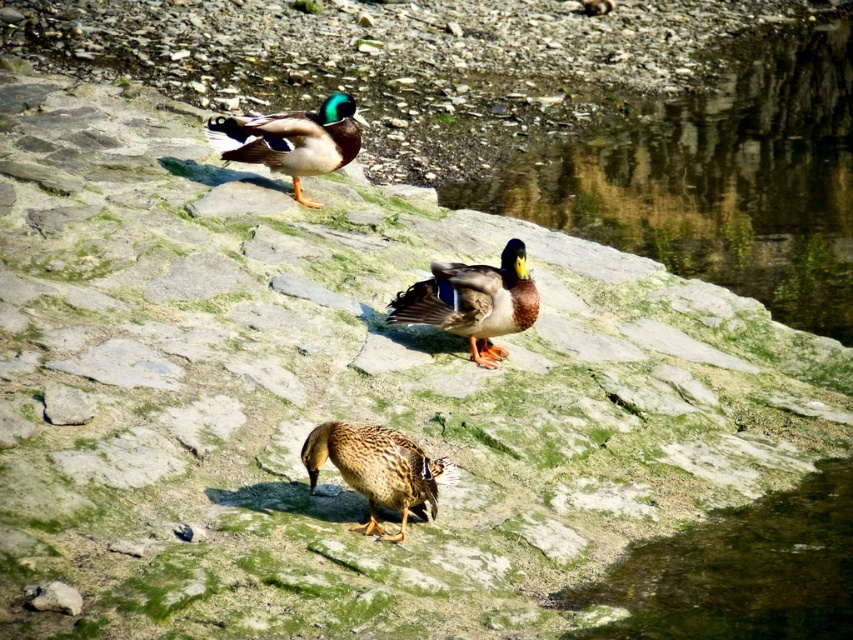
Does shiny brown duck at center have a greater width compared to shiny green and brown duck at upper center?

Incorrect, shiny brown duck at center's width does not surpass shiny green and brown duck at upper center's.

Does shiny brown duck at center come in front of shiny green and brown duck at upper center?

That is True.

Is point (535, 310) positioned before point (283, 170)?

Yes.

Where is `shiny brown duck at center`? This screenshot has height=640, width=853. shiny brown duck at center is located at coordinates (473, 301).

Does shiny brown duck at center appear on the right side of brown speckled feathers at center?

Indeed, shiny brown duck at center is positioned on the right side of brown speckled feathers at center.

Which is below, shiny brown duck at center or brown speckled feathers at center?

brown speckled feathers at center is lower down.

This screenshot has height=640, width=853. What do you see at coordinates (473, 301) in the screenshot? I see `shiny brown duck at center` at bounding box center [473, 301].

Locate an element on the screen. The width and height of the screenshot is (853, 640). shiny brown duck at center is located at coordinates (473, 301).

Does point (379, 538) come farther from viewer compared to point (299, 128)?

No.

Describe the element at coordinates (378, 468) in the screenshot. I see `brown speckled feathers at center` at that location.

Between point (404, 515) and point (264, 157), which one is positioned behind?

The point (264, 157) is more distant.

The image size is (853, 640). Identify the location of brown speckled feathers at center. click(x=378, y=468).